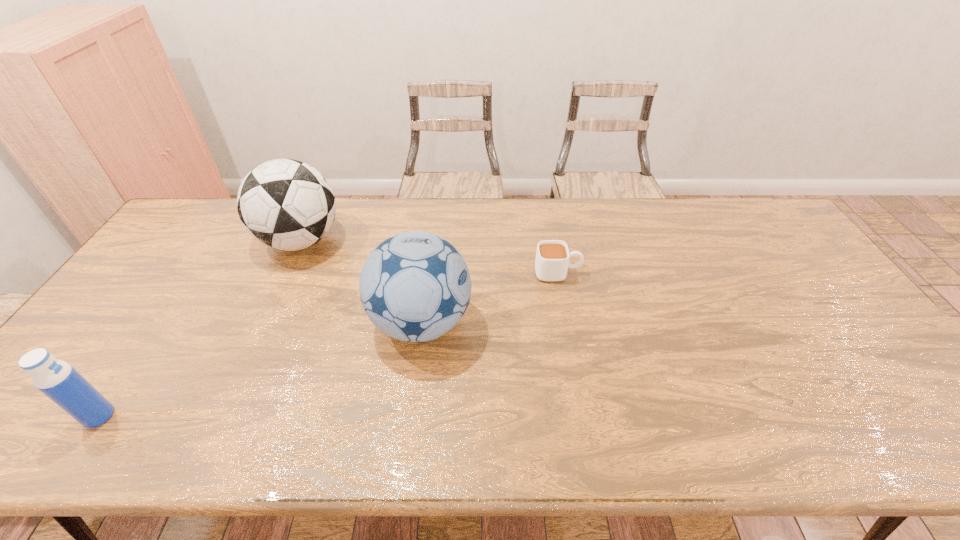
Identify the location of free spot between the second object from right to left and the water bottle. This screenshot has height=540, width=960. (260, 369).

This screenshot has width=960, height=540. I want to click on empty space that is in between the nearer soccer ball and the shortest object, so click(x=490, y=298).

Find the location of `empty location between the third farthest object and the water bottle`. empty location between the third farthest object and the water bottle is located at coordinates (260, 369).

Locate an element on the screen. The width and height of the screenshot is (960, 540). free point between the nearest object and the second object from right to left is located at coordinates (260, 369).

You are a GUI agent. You are given a task and a screenshot of the screen. Output one action in this format:
    pyautogui.click(x=<x>, y=<y>)
    Task: Click on the vacant area that lies between the third tallest object and the third object from left to right
    The image size is (960, 540).
    Given the screenshot: What is the action you would take?
    pyautogui.click(x=260, y=369)

Identify the location of vacant area between the shortest object and the right soccer ball. This screenshot has height=540, width=960. (490, 298).

What are the coordinates of `vacant space in between the leftmost object and the left soccer ball` in the screenshot? It's located at (200, 328).

Locate an element on the screen. free space between the third tallest object and the nearer soccer ball is located at coordinates (260, 369).

This screenshot has width=960, height=540. I want to click on object that is the closest to the water bottle, so click(285, 204).

Where is `the third closest object relative to the nearer soccer ball`? the third closest object relative to the nearer soccer ball is located at coordinates (58, 380).